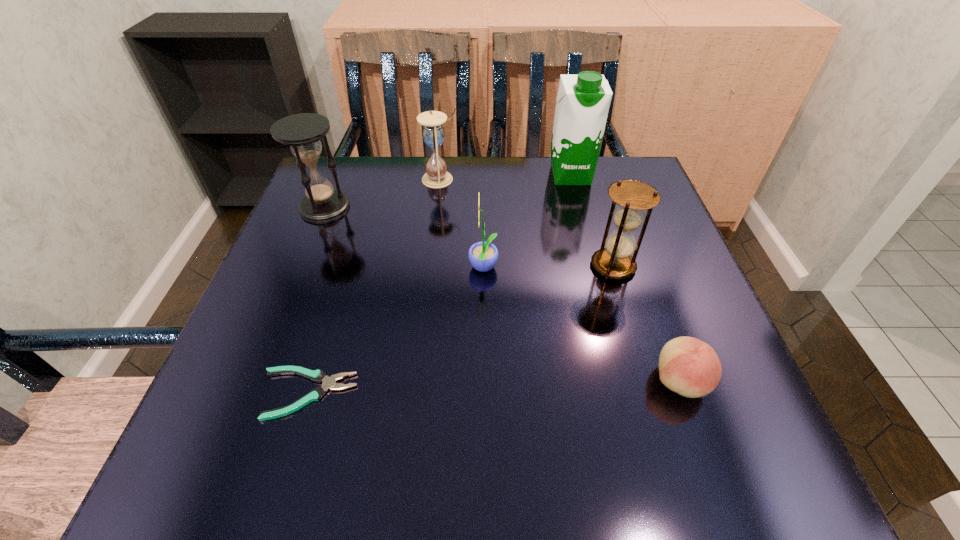
Where is `blank space at the left edge of the desktop`? blank space at the left edge of the desktop is located at coordinates (271, 385).

In the image, there is a desktop. At what (x,y) coordinates should I click in order to perform the action: click on vacant space at the right edge. Please return your answer as a coordinate pair (x, y). The width and height of the screenshot is (960, 540). Looking at the image, I should click on (646, 227).

In the image, there is a desktop. Where is `vacant space at the far left corner`? This screenshot has height=540, width=960. vacant space at the far left corner is located at coordinates (332, 156).

The image size is (960, 540). What are the coordinates of `free location at the near left corner of the desktop` in the screenshot? It's located at (230, 435).

Where is `vacant space at the far right corner of the desktop`? Image resolution: width=960 pixels, height=540 pixels. vacant space at the far right corner of the desktop is located at coordinates (593, 214).

The image size is (960, 540). In order to click on vacant point at the near right corner in this screenshot , I will do `click(714, 472)`.

Locate an element on the screen. free space between the pliers and the second hourglass from right to left is located at coordinates (373, 287).

You are a GUI agent. You are given a task and a screenshot of the screen. Output one action in this format:
    pyautogui.click(x=<x>, y=<y>)
    Task: Click on the free spot between the rightmost hourglass and the soya milk
    
    Given the screenshot: What is the action you would take?
    pyautogui.click(x=591, y=220)

You are a GUI agent. You are given a task and a screenshot of the screen. Output one action in this format:
    pyautogui.click(x=<x>, y=<y>)
    Task: Click on the free area in between the shortest object and the farthest hourglass
    
    Given the screenshot: What is the action you would take?
    pyautogui.click(x=373, y=287)

This screenshot has height=540, width=960. Identify the location of vacant space that's between the second nearest hourglass and the fourth object from right to left. (404, 238).